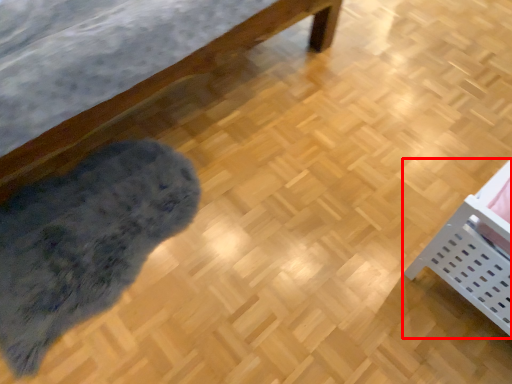
Question: Considering the relative positions of furniture (annotated by the red box) and mat in the image provided, where is furniture (annotated by the red box) located with respect to the staircase?

Choices:
 (A) right
 (B) left

Answer: (A)